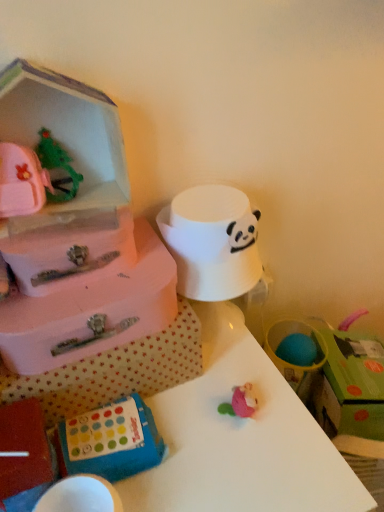
Locate an element on the screen. The height and width of the screenshot is (512, 384). free space above white glossy table at center (from a real-world perspective) is located at coordinates (189, 431).